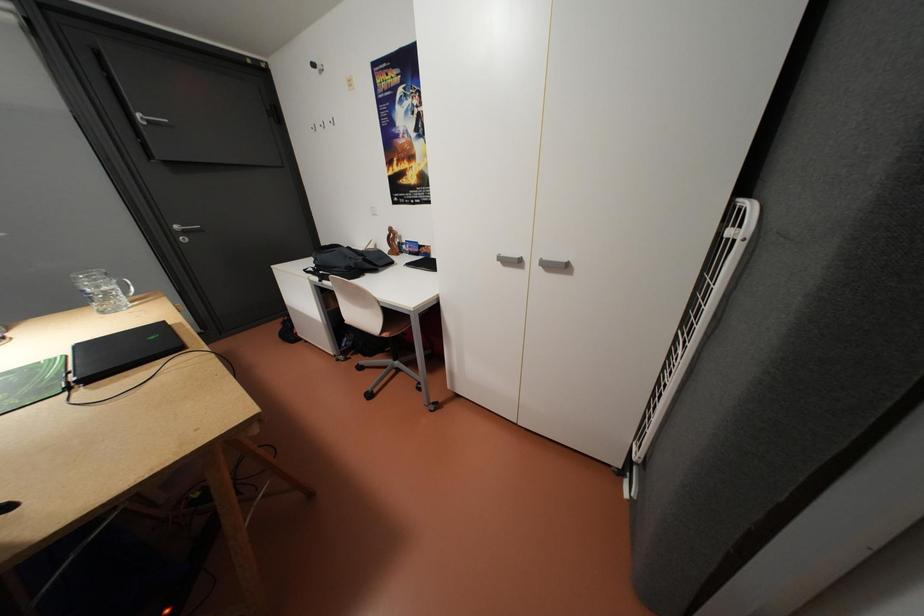
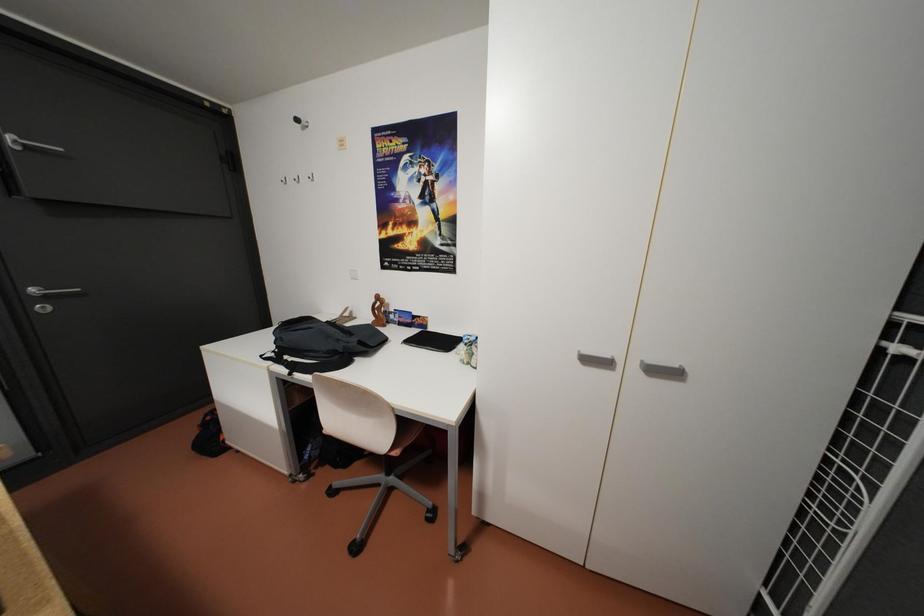
Which direction would the cameraman need to move to produce the second image?

The cameraman moved toward left, forward.